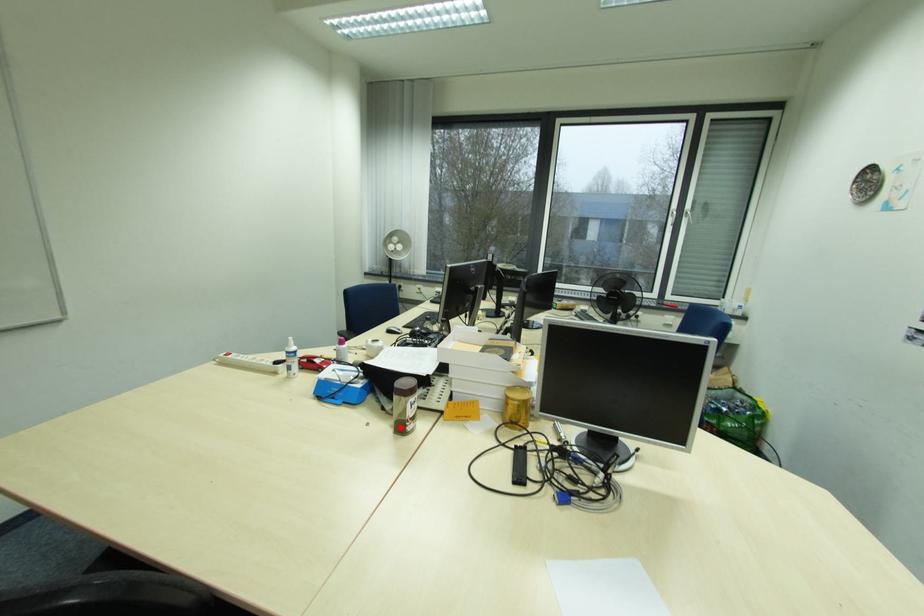
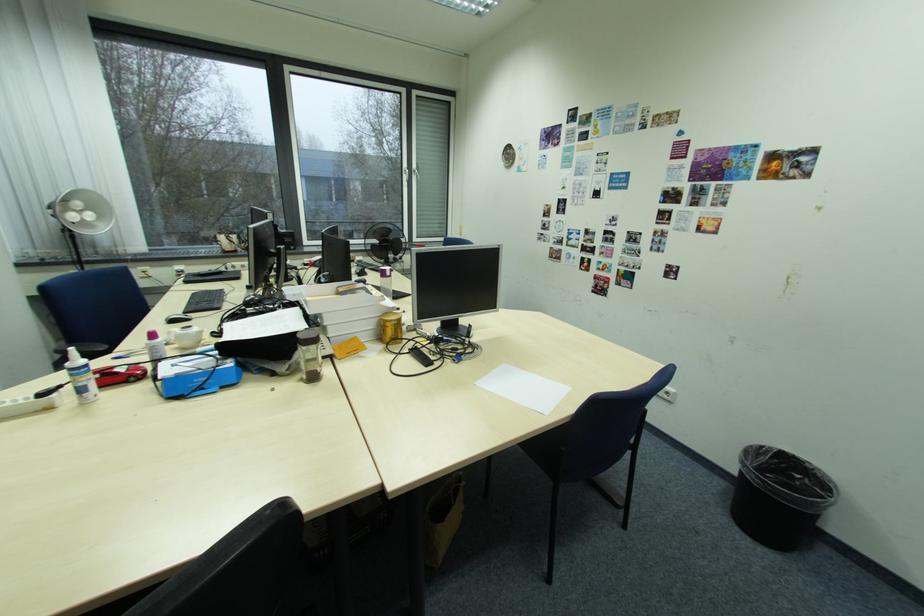
Find the pixel in the second image that matches the highlighted location in the first image.

(310, 381)